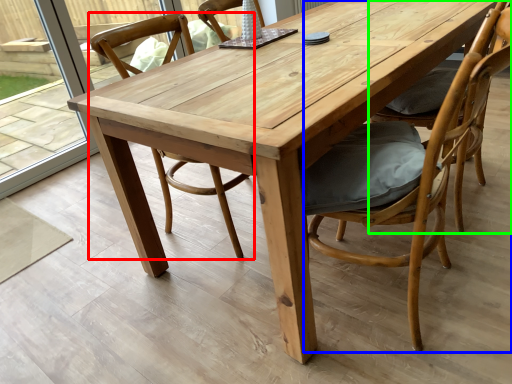
Question: Based on their relative distances, which object is nearer to chair (highlighted by a red box)? Choose from chair (highlighted by a blue box) and chair (highlighted by a green box).

Choices:
 (A) chair
 (B) chair

Answer: (A)